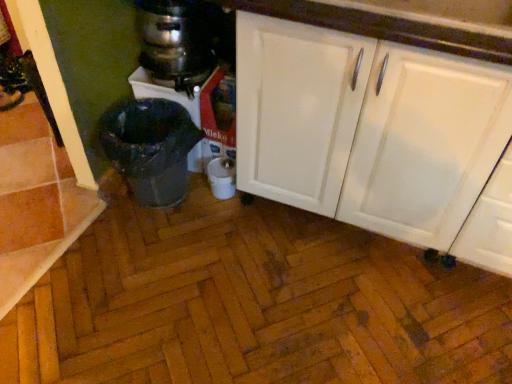
Question: Is metallic silver blender at center positioned in front of white glossy cabinet at upper right?

Choices:
 (A) no
 (B) yes

Answer: (A)

Question: Would you say metallic silver blender at center is outside white glossy cabinet at upper right?

Choices:
 (A) yes
 (B) no

Answer: (A)

Question: Does metallic silver blender at center have a larger size compared to white glossy cabinet at upper right?

Choices:
 (A) no
 (B) yes

Answer: (A)

Question: Considering the relative sizes of metallic silver blender at center and white glossy cabinet at upper right in the image provided, is metallic silver blender at center shorter than white glossy cabinet at upper right?

Choices:
 (A) yes
 (B) no

Answer: (B)

Question: Is there a large distance between metallic silver blender at center and white glossy cabinet at upper right?

Choices:
 (A) no
 (B) yes

Answer: (A)

Question: From the image's perspective, would you say metallic silver blender at center is positioned over white glossy cabinet at upper right?

Choices:
 (A) yes
 (B) no

Answer: (B)

Question: From a real-world perspective, is metallic silver blender at center physically below metallic stainless steel coffee maker at upper left?

Choices:
 (A) yes
 (B) no

Answer: (A)

Question: Can you confirm if metallic silver blender at center is taller than metallic stainless steel coffee maker at upper left?

Choices:
 (A) yes
 (B) no

Answer: (A)

Question: Can we say metallic silver blender at center lies outside metallic stainless steel coffee maker at upper left?

Choices:
 (A) yes
 (B) no

Answer: (A)

Question: Could you tell me if metallic silver blender at center is facing metallic stainless steel coffee maker at upper left?

Choices:
 (A) yes
 (B) no

Answer: (B)

Question: From the image's perspective, is metallic silver blender at center located beneath metallic stainless steel coffee maker at upper left?

Choices:
 (A) no
 (B) yes

Answer: (B)

Question: Does metallic silver blender at center have a lesser height compared to metallic stainless steel coffee maker at upper left?

Choices:
 (A) no
 (B) yes

Answer: (A)

Question: From a real-world perspective, is metallic stainless steel coffee maker at upper left over white matte cabinet at center?

Choices:
 (A) no
 (B) yes

Answer: (B)